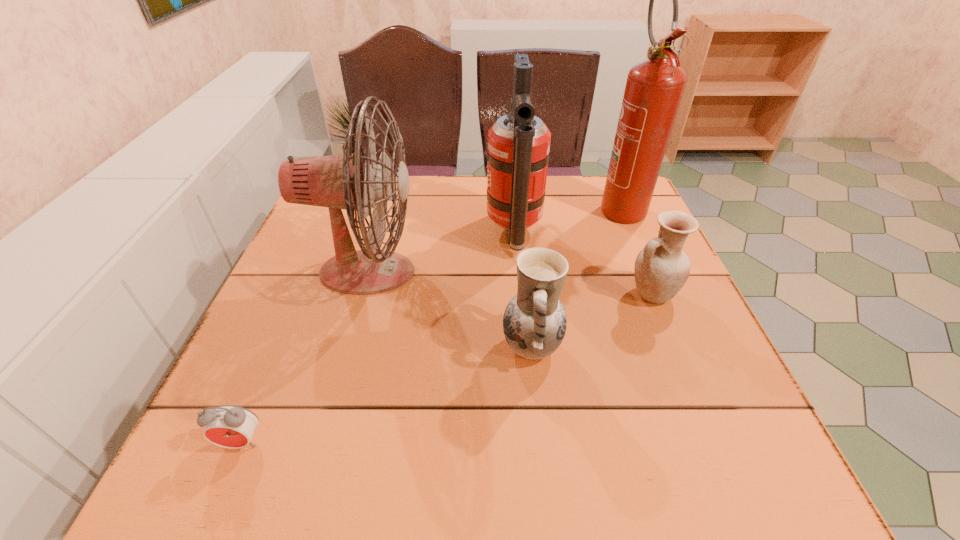
What are the coordinates of `free point between the fan and the right fire extinguisher` in the screenshot? It's located at (493, 239).

The image size is (960, 540). I want to click on empty location between the left fire extinguisher and the nearest object, so click(x=378, y=338).

Find the location of a particular element. The image size is (960, 540). empty space between the alarm clock and the fan is located at coordinates (304, 357).

Locate an element on the screen. free space between the farther pottery and the fan is located at coordinates (510, 284).

Identify the location of free spot between the shorter fire extinguisher and the shortest object. (378, 338).

At what (x,y) coordinates should I click in order to perform the action: click on empty space that is in between the left pottery and the right pottery. Please return your answer as a coordinate pair (x, y). The width and height of the screenshot is (960, 540). Looking at the image, I should click on (591, 320).

Identify the location of vacant area between the alarm clock and the right pottery. (446, 368).

You are a GUI agent. You are given a task and a screenshot of the screen. Output one action in this format:
    pyautogui.click(x=<x>, y=<y>)
    Task: Click on the object that ranks as the third closest to the fan
    Image resolution: width=960 pixels, height=540 pixels.
    Given the screenshot: What is the action you would take?
    228,426

Select which object is the second closest to the right pottery. Please provide its 2D coordinates. Your answer should be formatted as a tuple, i.e. [(x, y)], where the tuple contains the x and y coordinates of a point satisfying the conditions above.

[(518, 151)]

The image size is (960, 540). What are the coordinates of `free region that satisfies the following two spatial constraints: 1. on the front label side of the right pottery; 2. on the right side of the shorter fire extinguisher` in the screenshot? It's located at (519, 294).